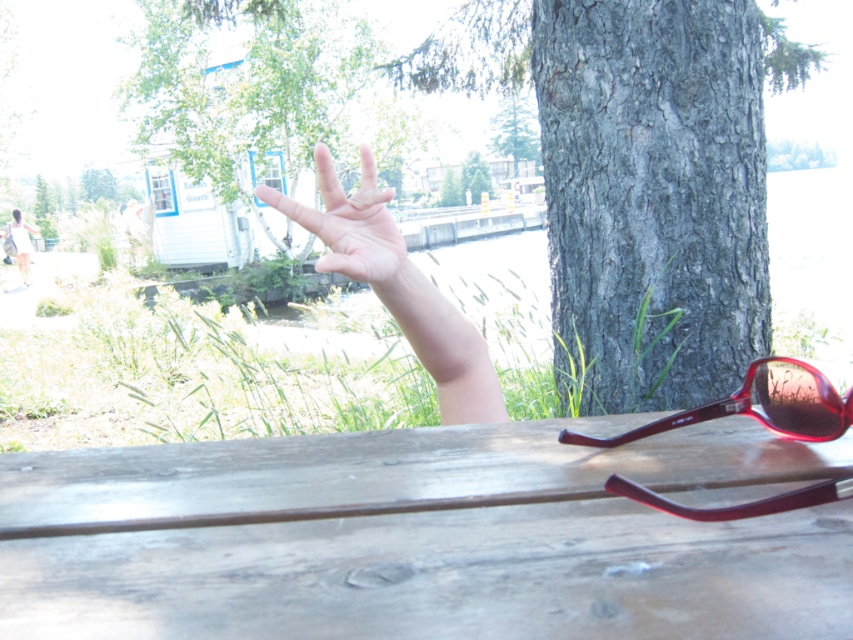
You are a photographer setting up a shot of the wooden table at center and the shiny red plastic sunglasses at lower right. To ensure both are in focus, you need to know which object is closer to the camera. Based on the scene, which one is closer?

The wooden table at center is closer to the camera than the shiny red plastic sunglasses at lower right because it is positioned in front of it.

Consider the image. You are standing at the point where the person is holding the peace sign. Can you see the wooden table at center from your current position?

Yes, because the wooden table at center is located at point [422,536], which is in the center of the image. Since you are standing near the center where the peace sign is made, you can see the wooden table at center.